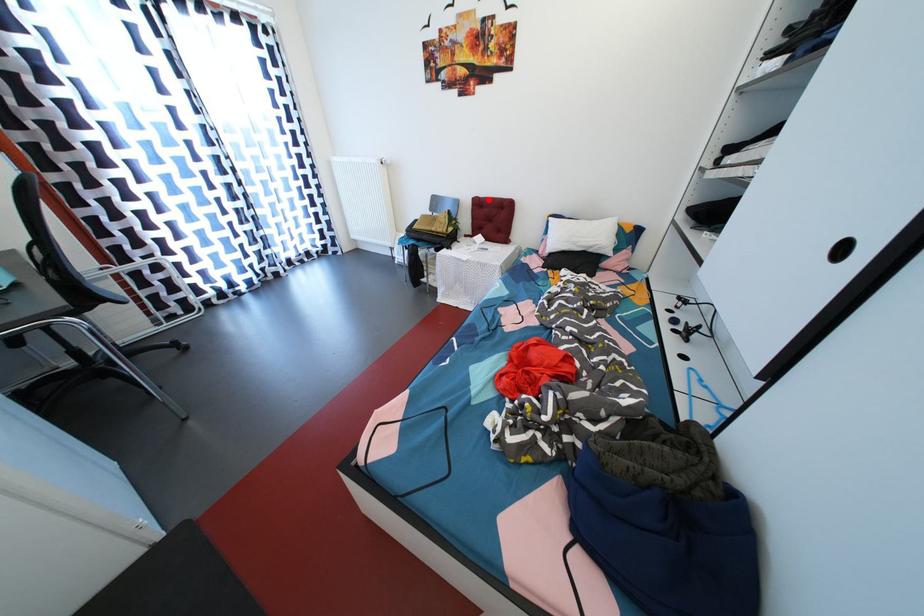
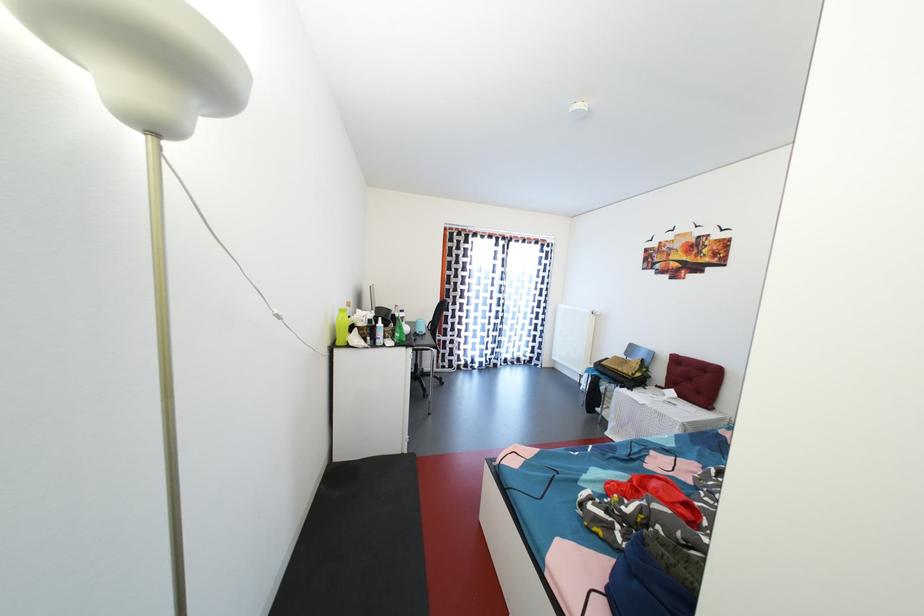
Where in the second image is the point corresponding to the highlighted location from the first image?

(688, 359)